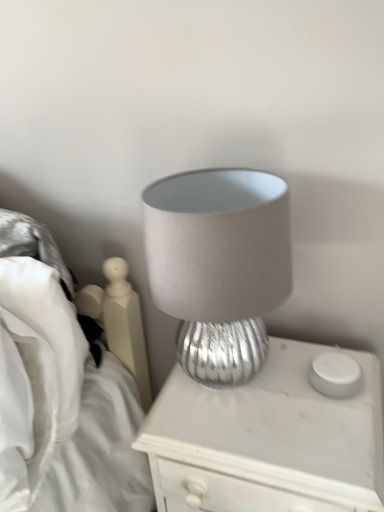
Where is `free space underneath satin gray lampshade at center (from a real-world perspective)`? free space underneath satin gray lampshade at center (from a real-world perspective) is located at coordinates (226, 379).